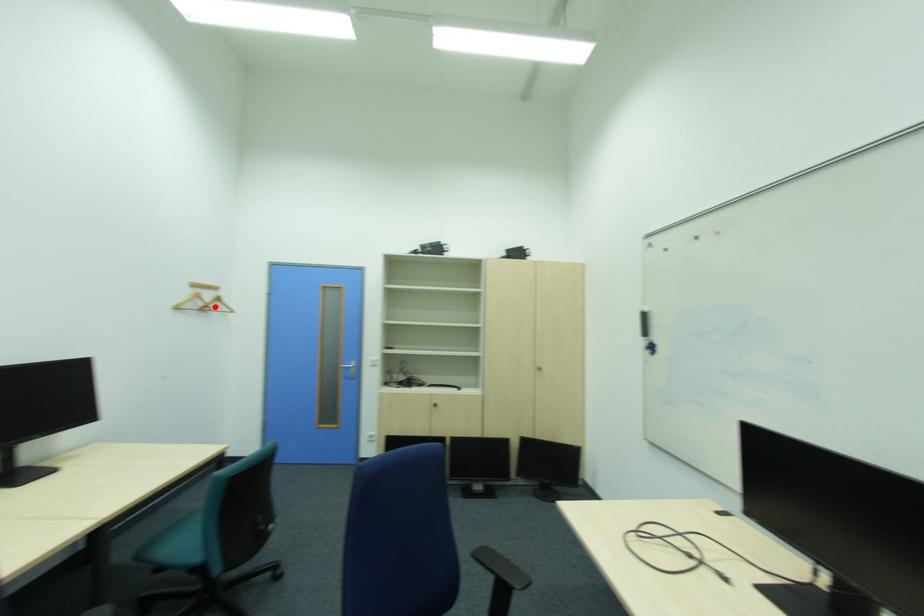
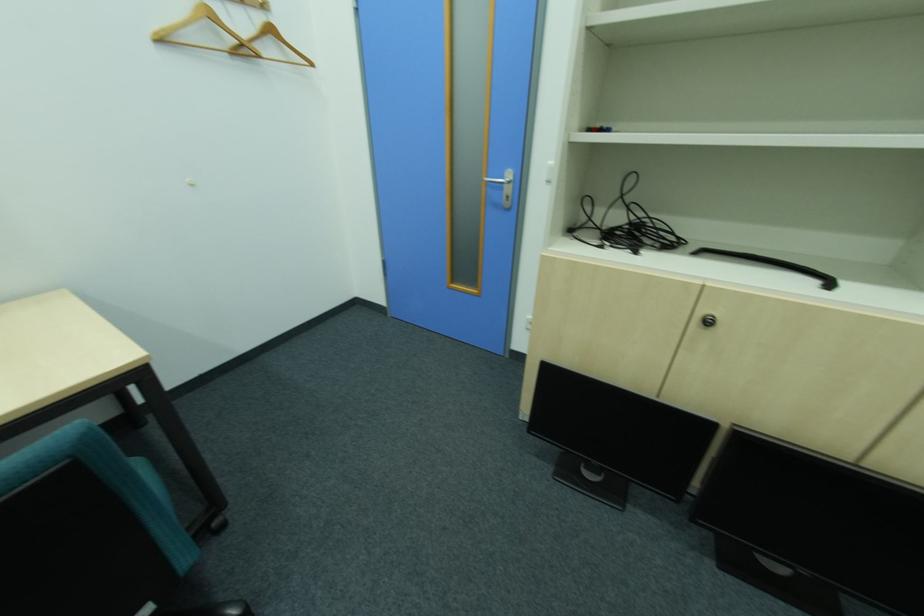
In the second image, find the point that corresponds to the highlighted location in the first image.

(249, 45)